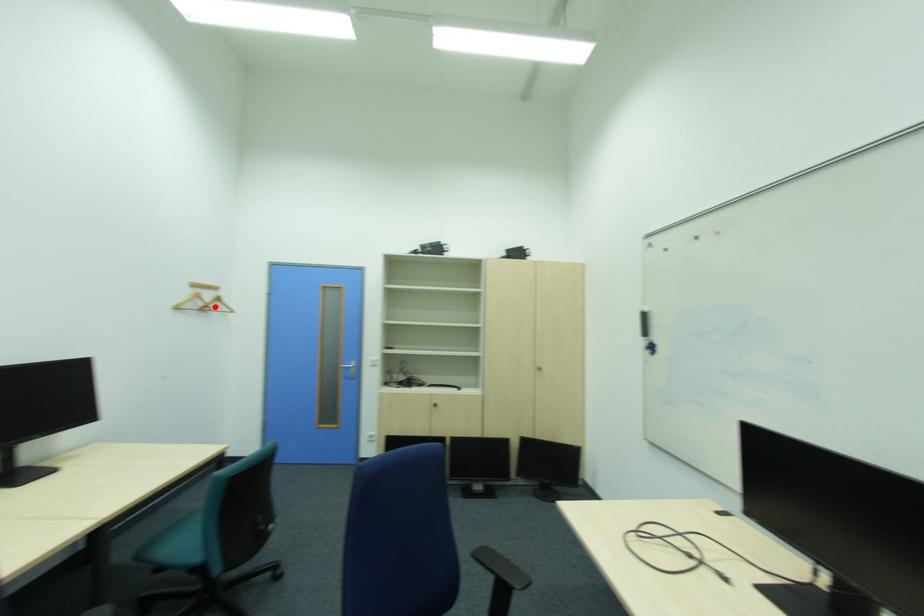
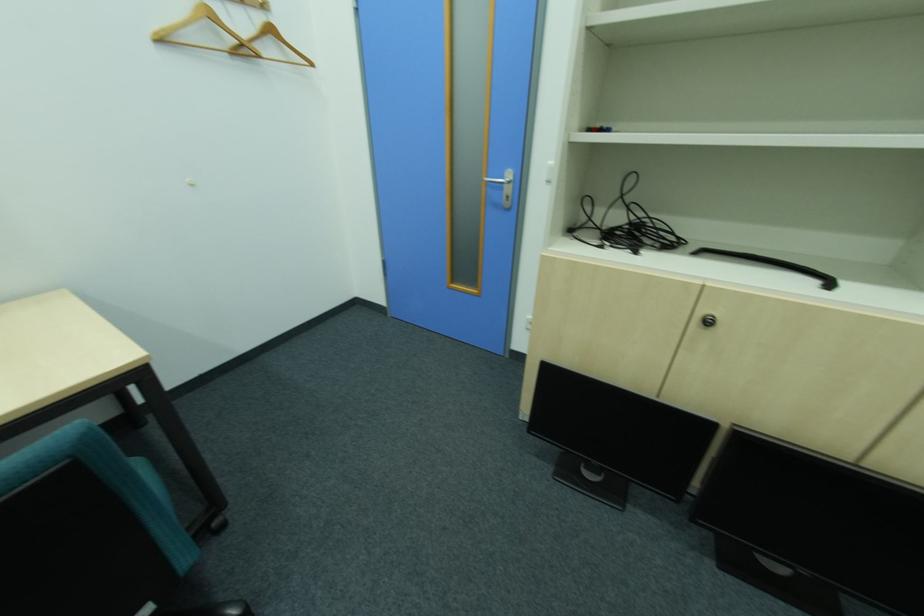
In the second image, find the point that corresponds to the highlighted location in the first image.

(249, 45)